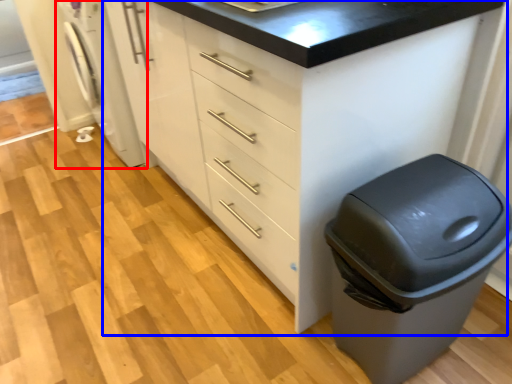
Question: Which of the following is the closest to the observer, washing machine (highlighted by a red box) or chest of drawers (highlighted by a blue box)?

Choices:
 (A) washing machine
 (B) chest of drawers

Answer: (B)